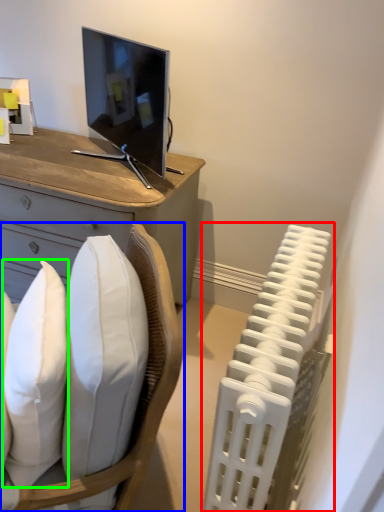
Question: Estimate the real-world distances between objects in this image. Which object is closer to radiator (highlighted by a red box), chair (highlighted by a blue box) or pillow (highlighted by a green box)?

Choices:
 (A) chair
 (B) pillow

Answer: (A)